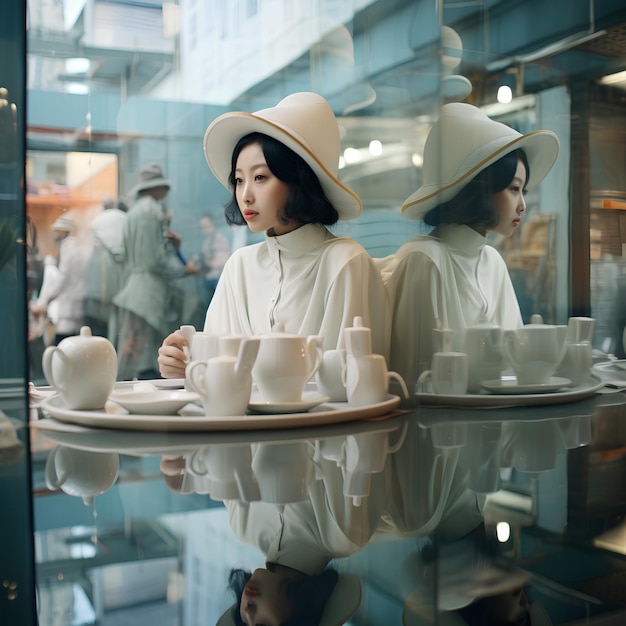
The height and width of the screenshot is (626, 626). In order to click on drinking vessels in this screenshot , I will do `click(216, 390)`, `click(278, 371)`, `click(372, 390)`, `click(327, 375)`, `click(201, 349)`, `click(232, 349)`, `click(95, 370)`.